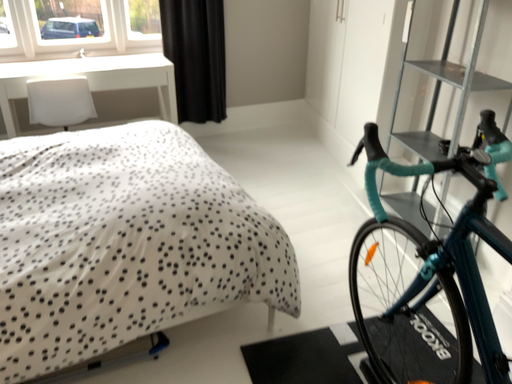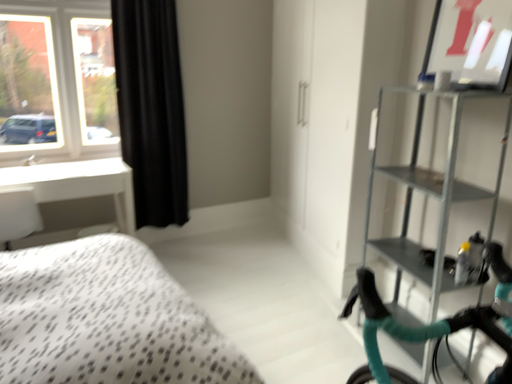
Question: How did the camera likely rotate when shooting the video?

Choices:
 (A) rotated downward
 (B) rotated upward

Answer: (B)